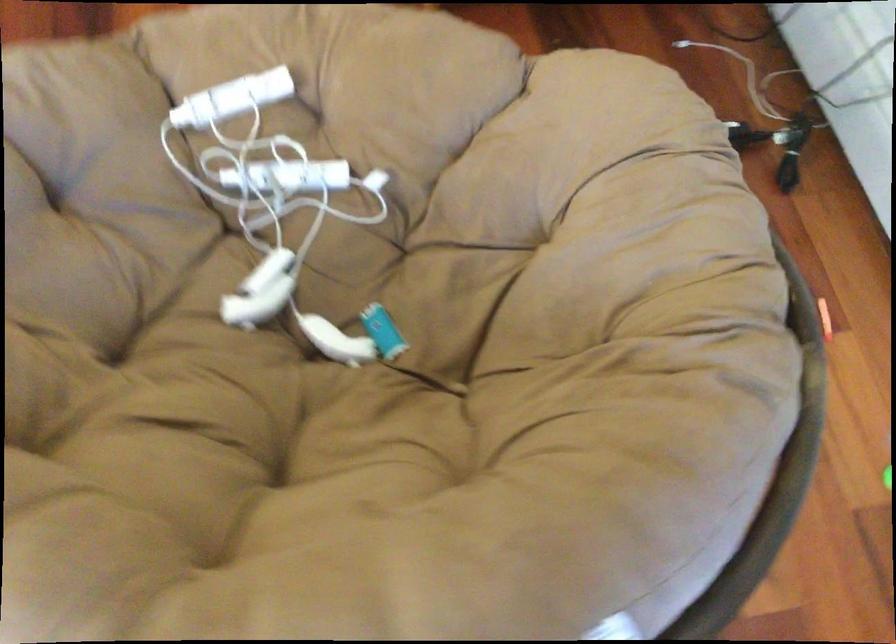
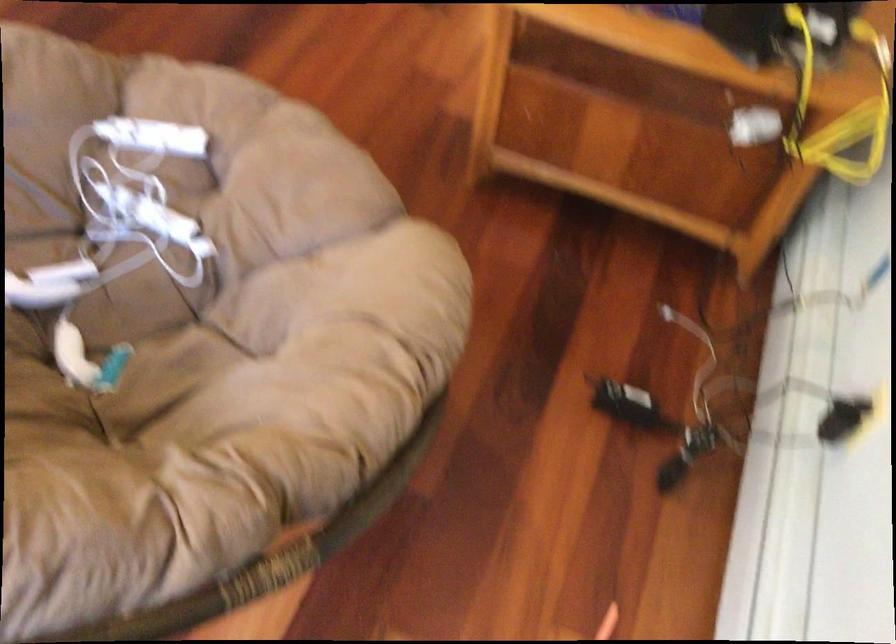
Where in the second image is the point corresponding to point 306,149 from the first image?

(181, 205)